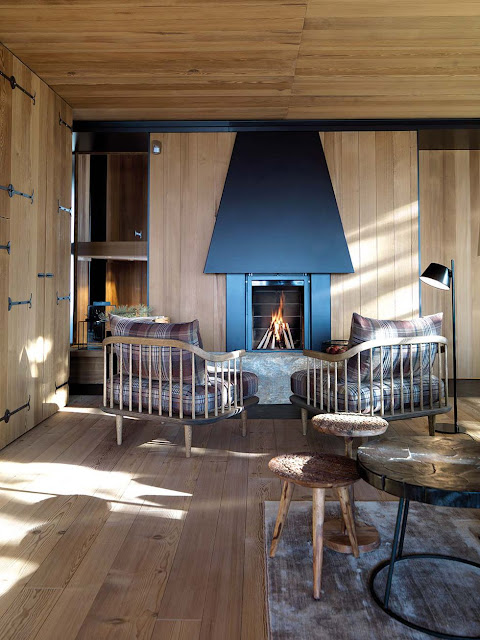
Identify the location of lamp. (437, 278).